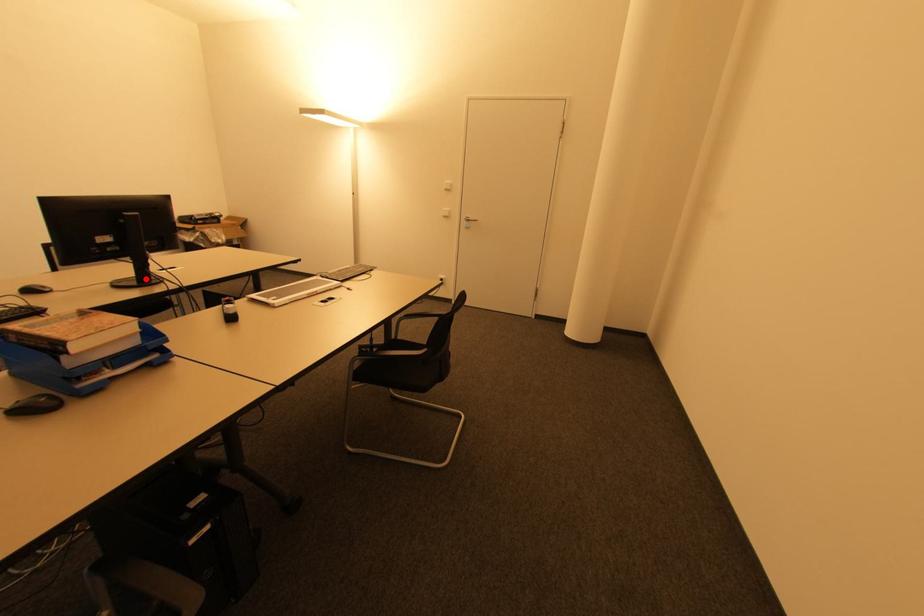
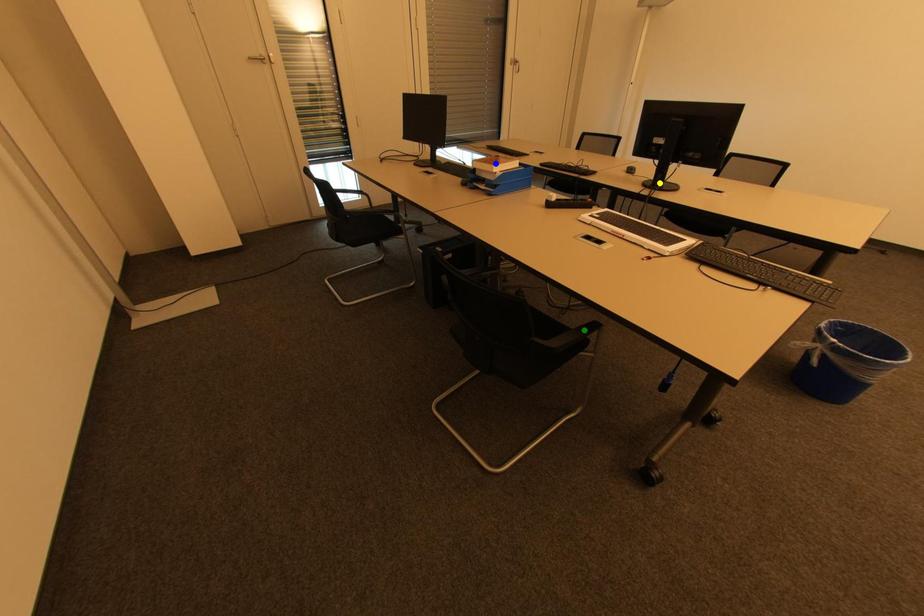
Question: I am providing you with two images of the same scene from different viewpoints. A red point is marked on the first image. You are given multiple points on the second image. Which spot in image 2 lines up with the point in image 1?

Choices:
 (A) blue point
 (B) green point
 (C) yellow point

Answer: (C)